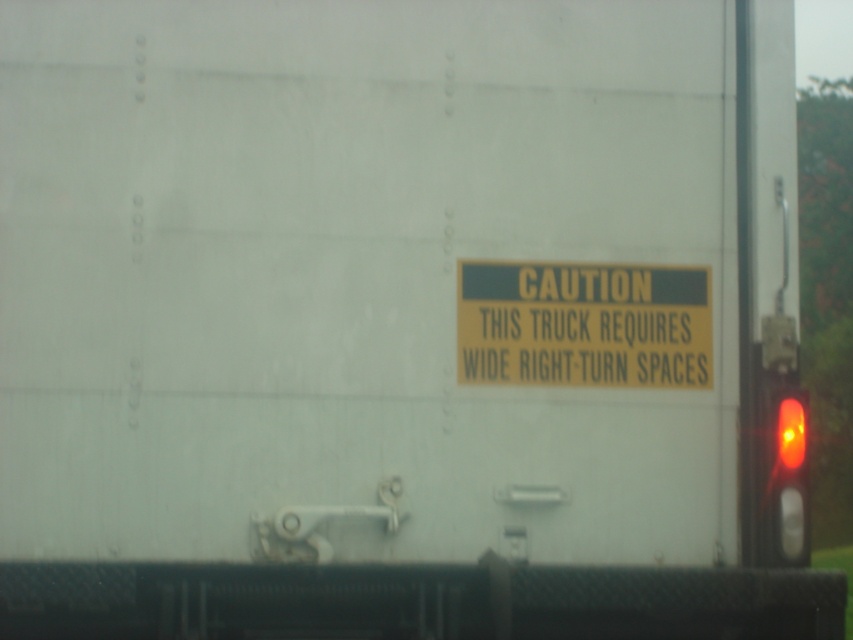
Question: Is yellow paper sign at center to the left of amber glass traffic light at right from the viewer's perspective?

Choices:
 (A) yes
 (B) no

Answer: (A)

Question: Which point is closer to the camera taking this photo?

Choices:
 (A) (764, 422)
 (B) (697, 301)

Answer: (A)

Question: Does yellow paper sign at center have a lesser width compared to amber glass traffic light at right?

Choices:
 (A) yes
 (B) no

Answer: (B)

Question: In this image, where is yellow paper sign at center located relative to amber glass traffic light at right?

Choices:
 (A) above
 (B) below

Answer: (A)